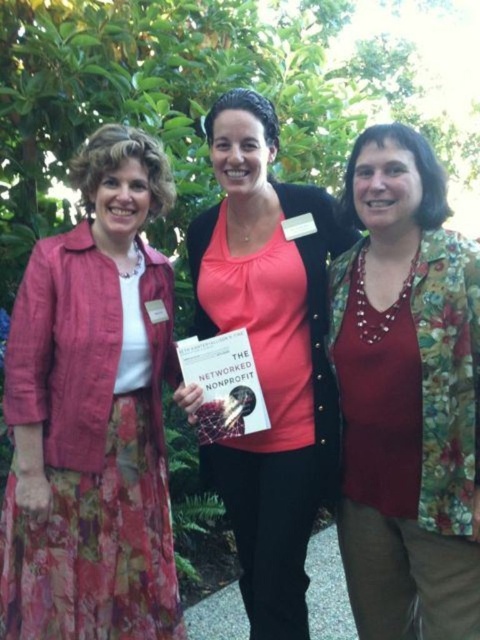
You are a photographer standing at the scene. You want to take a photo of the matte pink jacket at left without any people in the frame. Is it possible to do so?

The matte pink jacket at left and viewer are 2.45 meters apart from each other. Since the jacket is positioned at the left and there are no people blocking the view between you and the jacket, it is possible to take a photo of the matte pink jacket at left without any people in the frame.

You are a photographer at the event and need to adjust the camera focus. Which object, the matte pink jacket at left or the floral fabric blouse at center, is positioned higher in the frame?

The matte pink jacket at left is taller than the floral fabric blouse at center, so the matte pink jacket at left is positioned higher in the frame.

You are trying to decide which piece of clothing to take with you for a day out. Based on the image, which item is larger in size between the matte pink jacket at left and the floral fabric blouse at center?

The matte pink jacket at left is bigger than the floral fabric blouse at center, so you should take the matte pink jacket at left if you need a larger item.